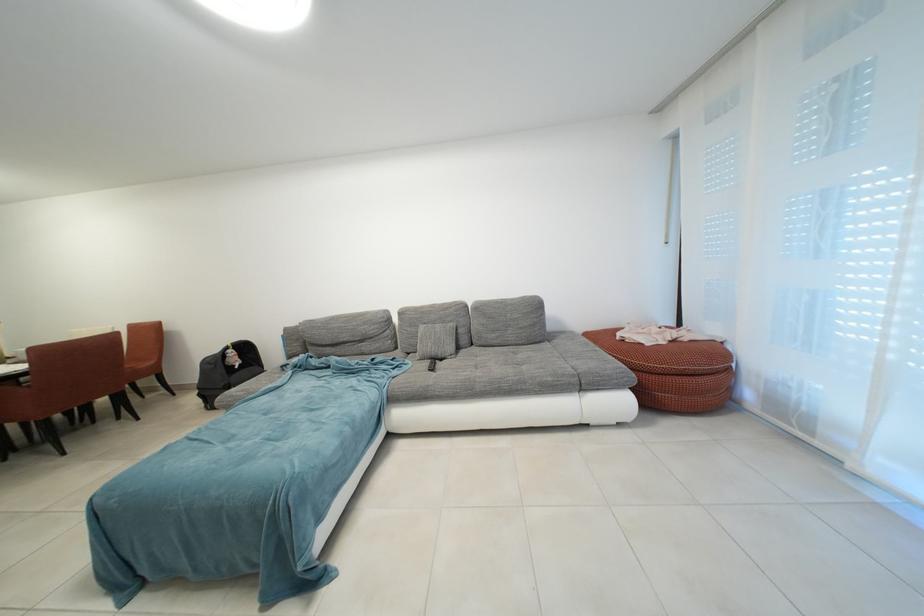
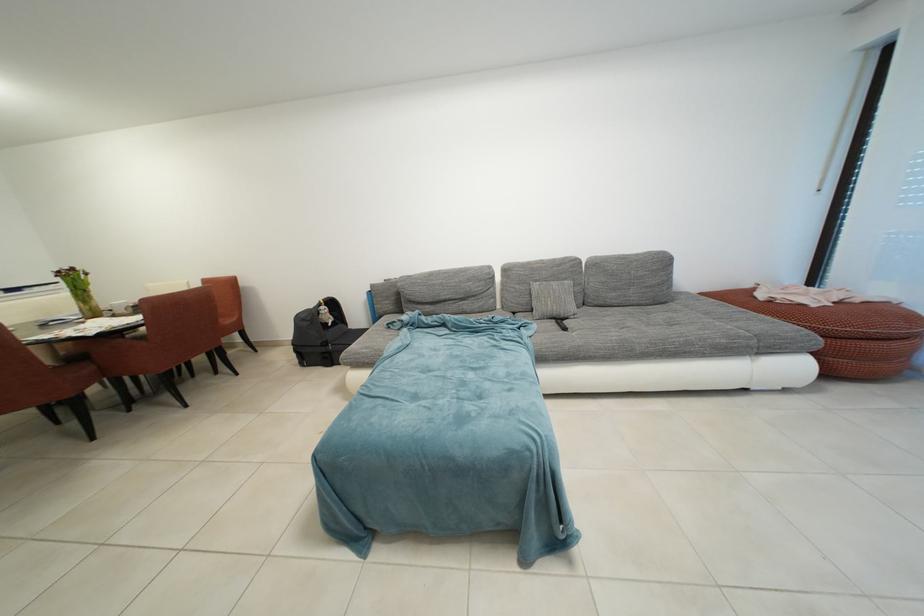
Locate, in the second image, the point that corresponds to pixel 236 353 in the first image.

(329, 309)